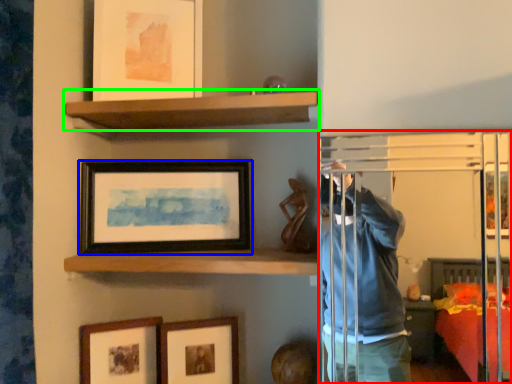
Question: Which object is positioned farthest from glass door (highlighted by a red box)? Select from picture frame (highlighted by a blue box) and shelf (highlighted by a green box).

Choices:
 (A) picture frame
 (B) shelf

Answer: (A)